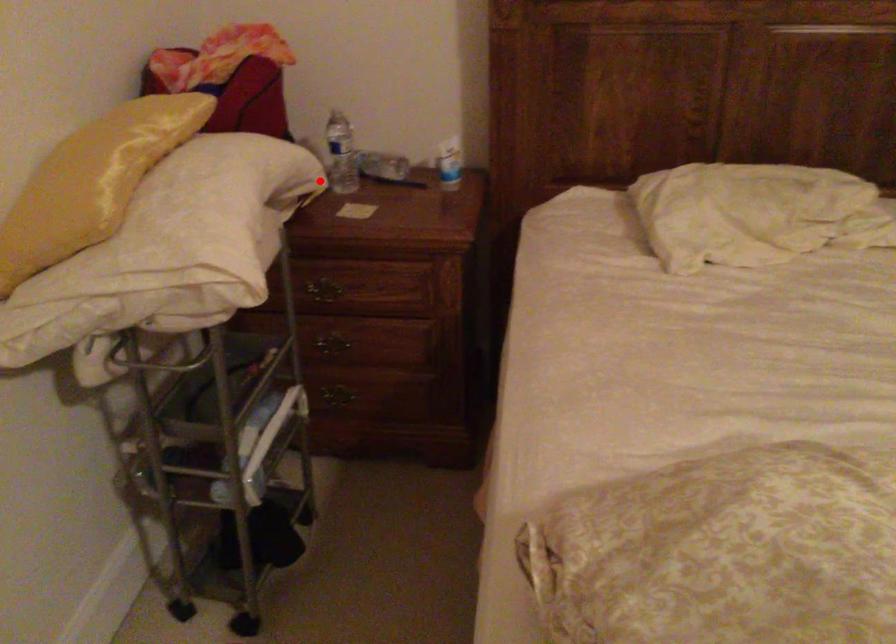
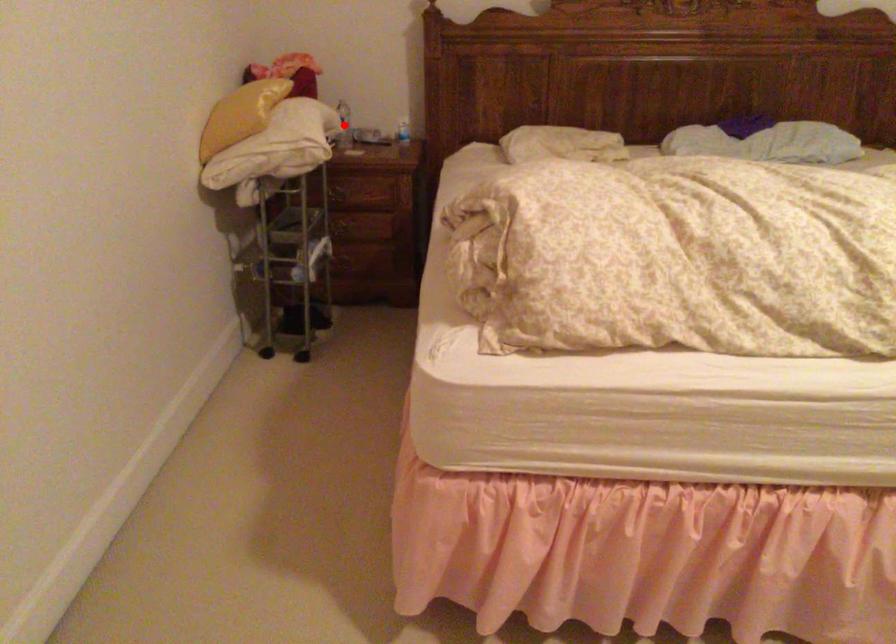
I am providing you with two images of the same scene from different viewpoints. A red point is marked on the first image and another point is marked on the second image. Are the points marked in image1 and image2 representing the same 3D position?

Yes